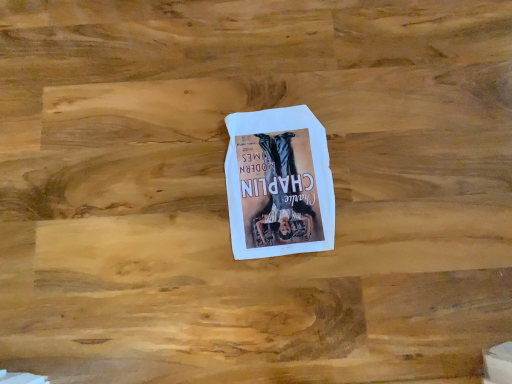
You are a GUI agent. You are given a task and a screenshot of the screen. Output one action in this format:
    pyautogui.click(x=<x>, y=<y>)
    Task: Click on the free point behind white paper at center
    The width and height of the screenshot is (512, 384).
    Given the screenshot: What is the action you would take?
    point(273,66)